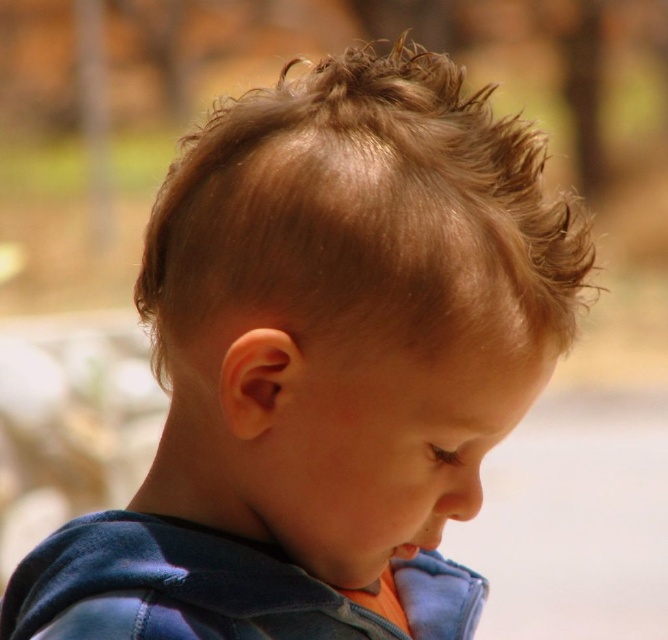
What are the coordinates of the light brown textured hair at center?

The light brown textured hair at center is located at point (363, 211).

You are a photographer adjusting the focus on your camera. You have to decide whether the light brown textured hair at center will be in focus if you focus on the velvet blue sweatshirt at lower left. Based on the scene description, what should you do?

The light brown textured hair at center is much taller than the velvet blue sweatshirt at lower left. Since the velvet blue sweatshirt at lower left is closer to the camera, focusing on it may cause the light brown textured hair at center to be out of focus due to the shallow depth of field. To ensure both are in focus, adjust the focus to a point between them or increase the depth of field.

You are a photographer adjusting the focus on your camera. You want to ensure that the light brown textured hair at center is sharp while keeping the background blurred. Given that the hair is 74.71 centimeters from the viewer, what should the minimum focusing distance be to achieve this?

The minimum focusing distance should be set to 74.71 centimeters to ensure the light brown textured hair at center is in sharp focus while maintaining the blurred background effect.